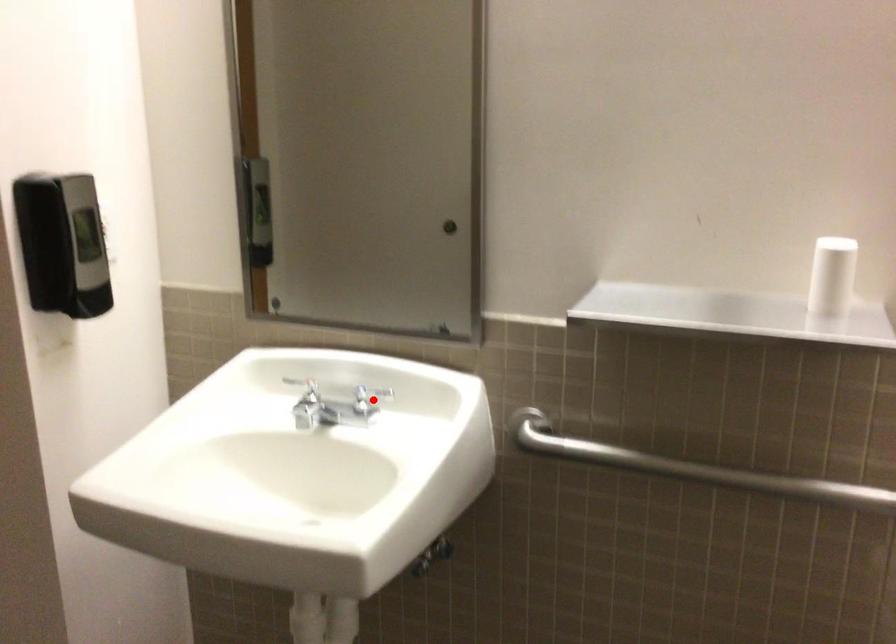
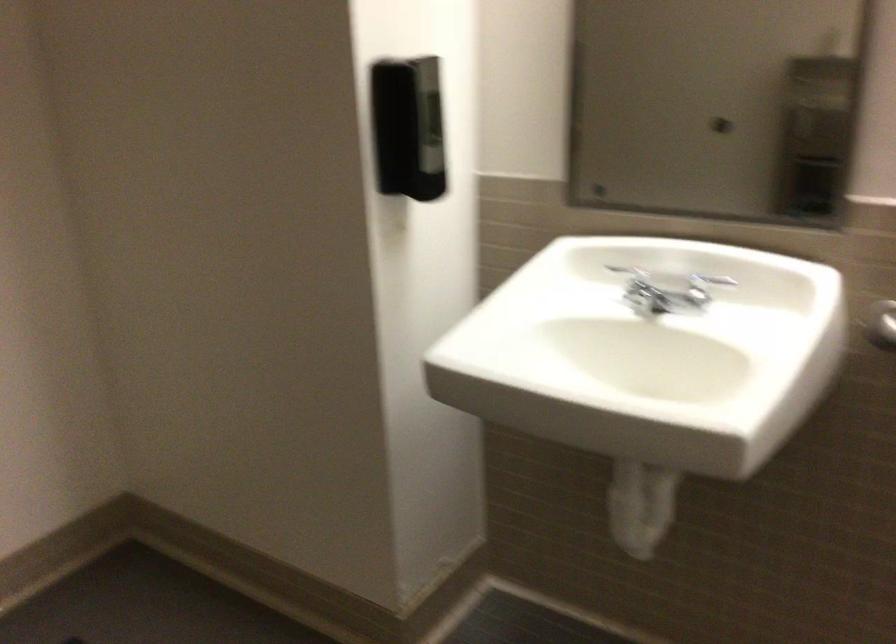
Where in the second image is the point corresponding to the highlighted location from the first image?

(704, 287)